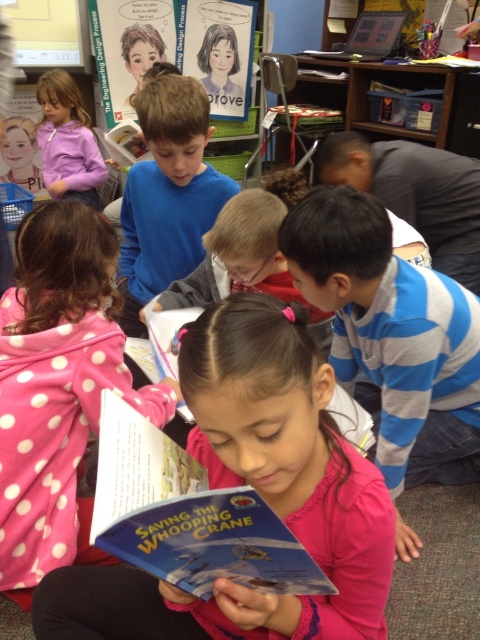
Question: Among these objects, which one is nearest to the camera?

Choices:
 (A) hardcover book at center
 (B) blue paper book at center
 (C) pink fabric book at center

Answer: (B)

Question: Does blue paper book at center have a larger size compared to hardcover book at center?

Choices:
 (A) no
 (B) yes

Answer: (B)

Question: Can you confirm if pink fabric book at center is bigger than pink polka dot hoodie at center?

Choices:
 (A) yes
 (B) no

Answer: (B)

Question: Which point appears farthest from the camera in this image?

Choices:
 (A) (106, 134)
 (B) (183, 228)

Answer: (A)

Question: Is pink polka dot hoodie at center to the left of blue paper book at center from the viewer's perspective?

Choices:
 (A) no
 (B) yes

Answer: (B)

Question: Which point is farther to the camera?

Choices:
 (A) pink fabric book at center
 (B) hardcover book at center
 (C) blue cotton shirt at center
 (D) pink polka dot hoodie at center

Answer: (B)